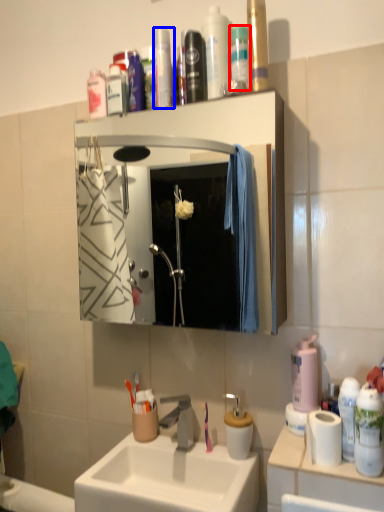
Question: Which of the following is the farthest to the observer, mouthwash (highlighted by a red box) or toiletry (highlighted by a blue box)?

Choices:
 (A) mouthwash
 (B) toiletry

Answer: (B)